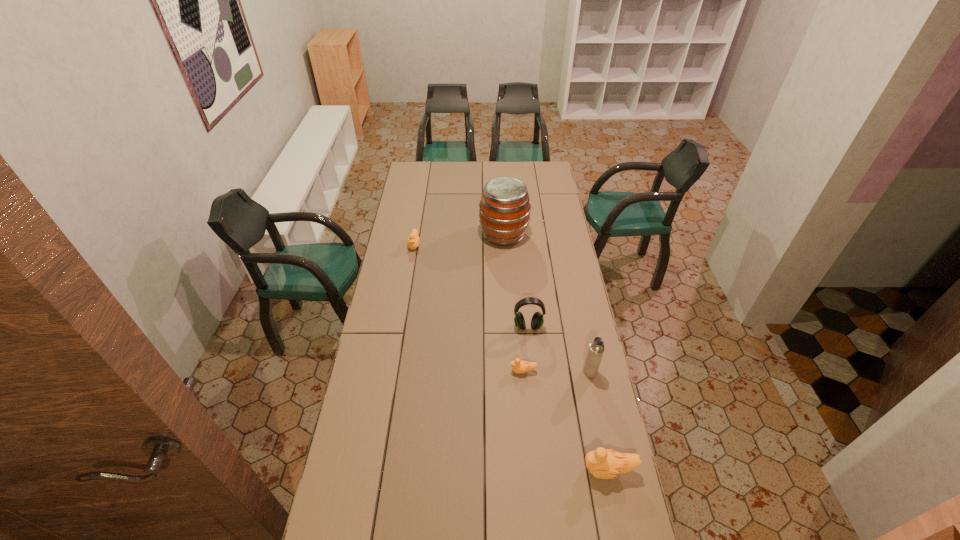
At what (x,y) coordinates should I click in order to perform the action: click on the second tallest duckling. Please return your answer as a coordinate pair (x, y). Looking at the image, I should click on point(413,240).

Where is `the farthest duckling`? The image size is (960, 540). the farthest duckling is located at coordinates (413, 240).

Where is `the second duckling from right to left`? This screenshot has height=540, width=960. the second duckling from right to left is located at coordinates (518, 366).

Where is `the second farthest duckling`? the second farthest duckling is located at coordinates (518, 366).

At what (x,y) coordinates should I click in order to perform the action: click on the nearest object. Please return your answer as a coordinate pair (x, y). The width and height of the screenshot is (960, 540). Looking at the image, I should click on (603, 463).

This screenshot has width=960, height=540. I want to click on the rightmost duckling, so click(x=603, y=463).

Find the location of a particular element. The width and height of the screenshot is (960, 540). the tallest object is located at coordinates (504, 209).

At what (x,y) coordinates should I click in order to perform the action: click on the third tallest object. Please return your answer as a coordinate pair (x, y). Image resolution: width=960 pixels, height=540 pixels. Looking at the image, I should click on (537, 320).

Identify the location of headset. (537, 320).

I want to click on thermos bottle, so click(596, 349).